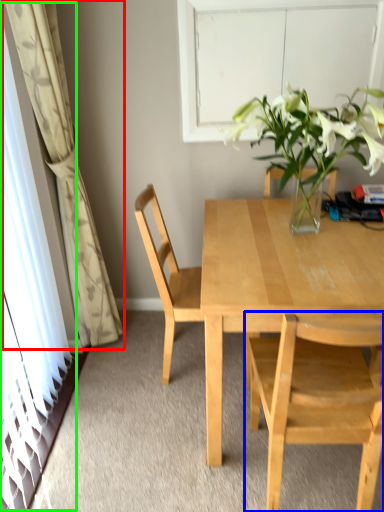
Question: Which object is positioned closest to curtain (highlighted by a red box)? Select from chair (highlighted by a blue box) and glass door (highlighted by a green box).

Choices:
 (A) chair
 (B) glass door

Answer: (B)